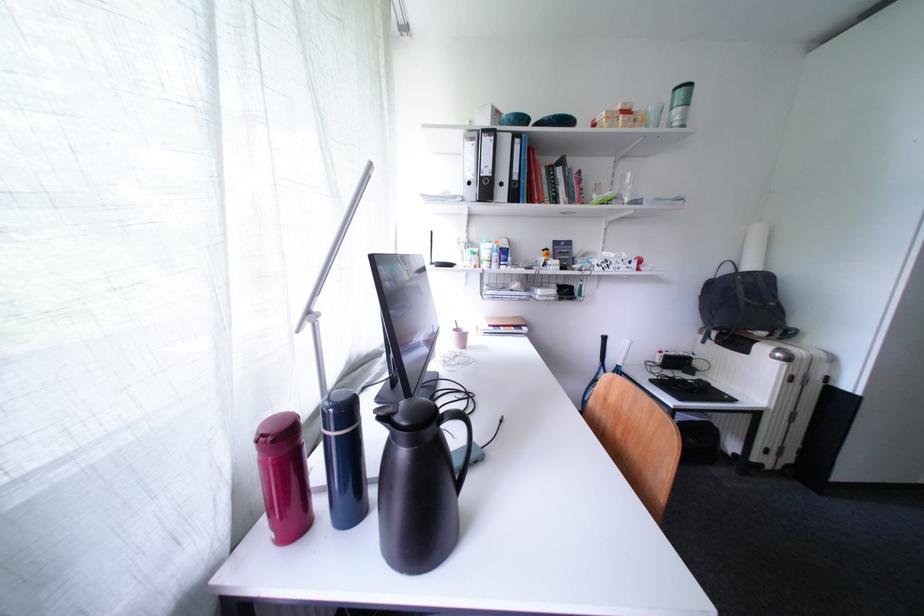
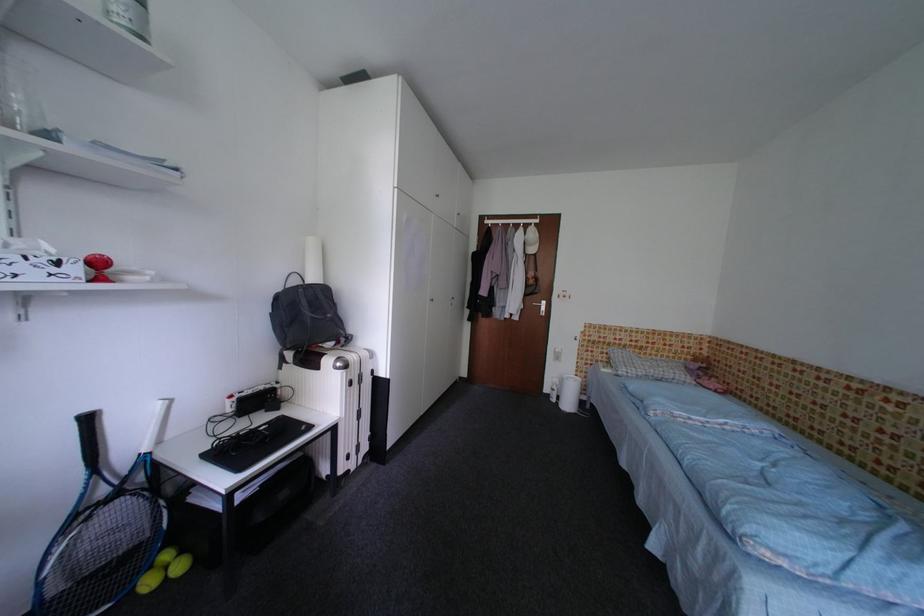
Find the pixel in the second image that matches pixel 798 382 in the first image.

(359, 386)